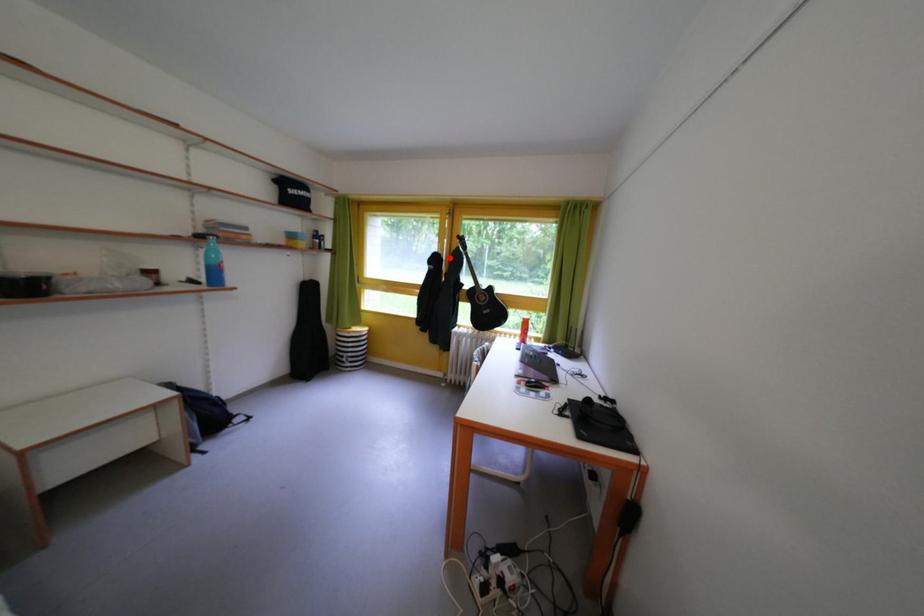
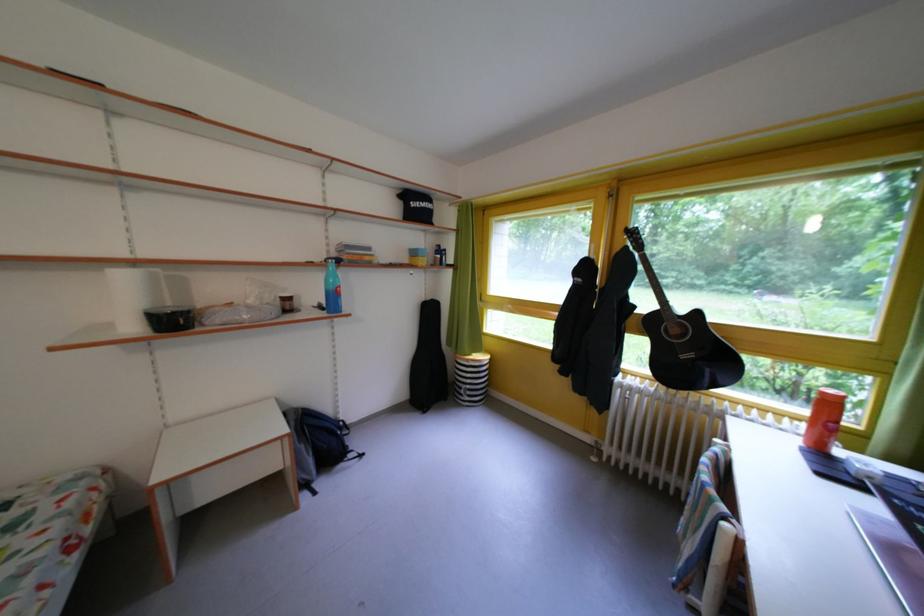
Locate, in the second image, the point that corresponds to the highlighted location in the first image.

(602, 262)